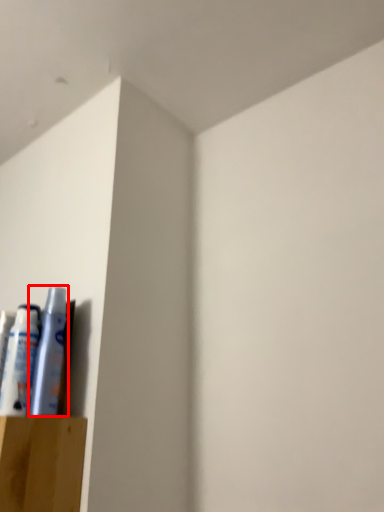
Question: In this image, where is toiletry (annotated by the red box) located relative to toiletry?

Choices:
 (A) right
 (B) left

Answer: (A)